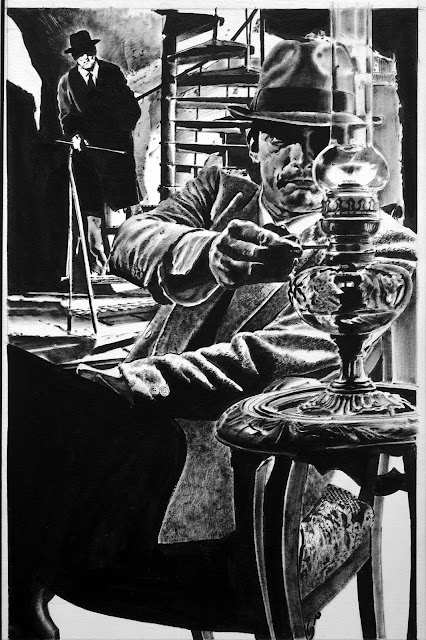
Locate an element on the screen. The image size is (426, 640). oil lamp is located at coordinates (351, 223).